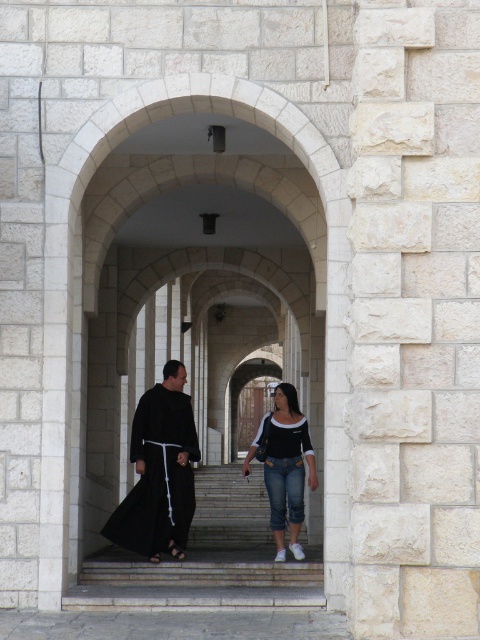
Question: Which object is the farthest from the black matte robe at center?

Choices:
 (A) black matte clothing at center
 (B) denim jeans at center

Answer: (B)

Question: Is black matte robe at center to the right of denim jeans at center from the viewer's perspective?

Choices:
 (A) yes
 (B) no

Answer: (B)

Question: Can you confirm if black matte clothing at center is thinner than denim jeans at center?

Choices:
 (A) no
 (B) yes

Answer: (A)

Question: Considering the relative positions of black matte clothing at center and denim jeans at center in the image provided, where is black matte clothing at center located with respect to denim jeans at center?

Choices:
 (A) above
 (B) below

Answer: (A)

Question: Estimate the real-world distances between objects in this image. Which object is farther from the black matte robe at center?

Choices:
 (A) black matte clothing at center
 (B) denim jeans at center

Answer: (B)

Question: Estimate the real-world distances between objects in this image. Which object is farther from the black matte robe at center?

Choices:
 (A) black matte clothing at center
 (B) denim jeans at center

Answer: (B)